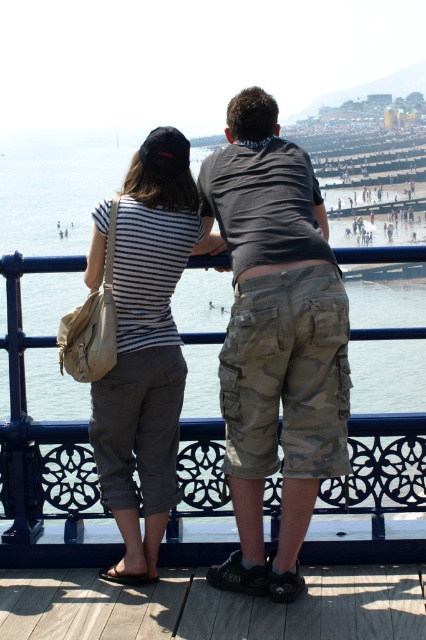
Question: Which of the following is the farthest from the observer?

Choices:
 (A) (19, 419)
 (B) (146, 157)
 (C) (216, 189)

Answer: (A)

Question: Is camo shorts at center to the left of clear blue water at center from the viewer's perspective?

Choices:
 (A) no
 (B) yes

Answer: (A)

Question: Does camo shorts at center have a larger size compared to striped cotton shirt at center?

Choices:
 (A) no
 (B) yes

Answer: (B)

Question: Which is farther from the clear blue water at center?

Choices:
 (A) striped cotton shirt at center
 (B) camo shorts at center

Answer: (A)

Question: In this image, where is clear blue water at center located relative to striped cotton shirt at center?

Choices:
 (A) right
 (B) left

Answer: (B)

Question: Which point is closer to the camera taking this photo?

Choices:
 (A) (72, 465)
 (B) (146, 573)
 (C) (296, 372)

Answer: (C)